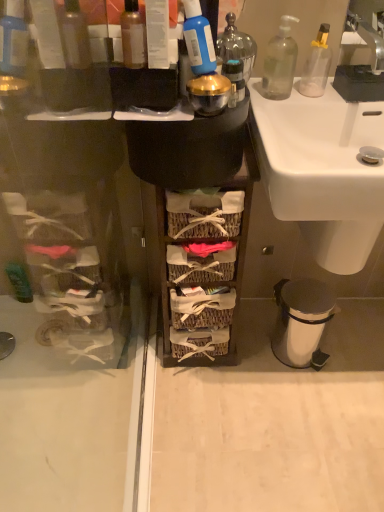
Question: Is white plastic trash can at lower right not within blue plastic bottle at upper center?

Choices:
 (A) no
 (B) yes

Answer: (B)

Question: Is white plastic trash can at lower right looking in the opposite direction of blue plastic bottle at upper center?

Choices:
 (A) yes
 (B) no

Answer: (B)

Question: Does white plastic trash can at lower right have a smaller size compared to blue plastic bottle at upper center?

Choices:
 (A) no
 (B) yes

Answer: (A)

Question: From a real-world perspective, is white plastic trash can at lower right on top of blue plastic bottle at upper center?

Choices:
 (A) no
 (B) yes

Answer: (A)

Question: Is the position of white plastic trash can at lower right more distant than that of blue plastic bottle at upper center?

Choices:
 (A) yes
 (B) no

Answer: (A)

Question: Considering the relative sizes of white plastic trash can at lower right and blue plastic bottle at upper center in the image provided, is white plastic trash can at lower right wider than blue plastic bottle at upper center?

Choices:
 (A) yes
 (B) no

Answer: (A)

Question: Is white plastic trash can at lower right bigger than transparent glass soap dispenser at upper right, arranged as the first bottle when viewed from the right?

Choices:
 (A) yes
 (B) no

Answer: (A)

Question: From a real-world perspective, does white plastic trash can at lower right sit lower than transparent glass soap dispenser at upper right, which is the first bottle from back to front?

Choices:
 (A) yes
 (B) no

Answer: (A)

Question: From the image's perspective, would you say white plastic trash can at lower right is shown under transparent glass soap dispenser at upper right, the third bottle from the front?

Choices:
 (A) yes
 (B) no

Answer: (A)

Question: Is white plastic trash can at lower right located outside transparent glass soap dispenser at upper right, which is the first bottle from back to front?

Choices:
 (A) no
 (B) yes

Answer: (B)

Question: Considering the relative positions of white plastic trash can at lower right and transparent glass soap dispenser at upper right, arranged as the first bottle when viewed from the right, in the image provided, is white plastic trash can at lower right to the left of transparent glass soap dispenser at upper right, arranged as the first bottle when viewed from the right, from the viewer's perspective?

Choices:
 (A) no
 (B) yes

Answer: (A)

Question: Is white plastic trash can at lower right aimed at transparent glass soap dispenser at upper right, which is the 3th bottle in left-to-right order?

Choices:
 (A) yes
 (B) no

Answer: (B)

Question: Is translucent glass bottle at upper center, which is the 2th bottle in front-to-back order, bigger than translucent plastic bottle at upper center, positioned as the 3th bottle in back-to-front order?

Choices:
 (A) no
 (B) yes

Answer: (B)